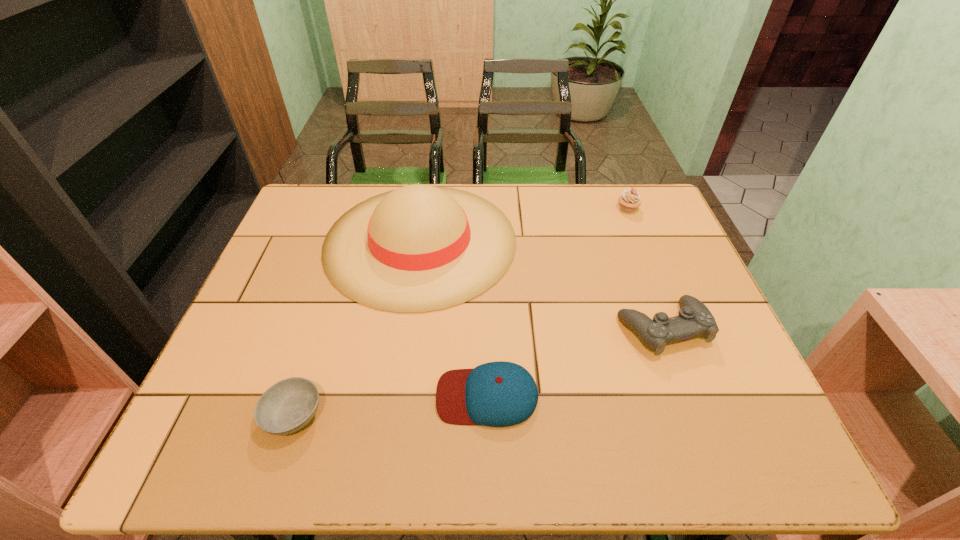
Image resolution: width=960 pixels, height=540 pixels. Find the location of `sombrero`. sombrero is located at coordinates (419, 248).

This screenshot has height=540, width=960. I want to click on cupcake, so click(630, 199).

At what (x,y) coordinates should I click in order to perform the action: click on control. Please return your answer as a coordinate pair (x, y). This screenshot has width=960, height=540. Looking at the image, I should click on (694, 319).

Find the location of a particular element. The width and height of the screenshot is (960, 540). baseball cap is located at coordinates (497, 394).

This screenshot has height=540, width=960. I want to click on the shortest object, so click(x=287, y=406).

At what (x,y) coordinates should I click in order to perform the action: click on free space located 0.130m on the left of the tallest object. Please return your answer as a coordinate pair (x, y). The image size is (960, 540). Looking at the image, I should click on (279, 241).

The height and width of the screenshot is (540, 960). Find the location of `free space located on the front of the cupcake`. free space located on the front of the cupcake is located at coordinates (647, 257).

Where is `vacant point located 0.390m on the left of the control`? vacant point located 0.390m on the left of the control is located at coordinates (454, 329).

Locate an element on the screen. free spot located with the bill of the baseball cap facing forward is located at coordinates (379, 396).

What are the coordinates of `free space located 0.190m with the bill of the baseball cap facing forward` in the screenshot? It's located at (346, 396).